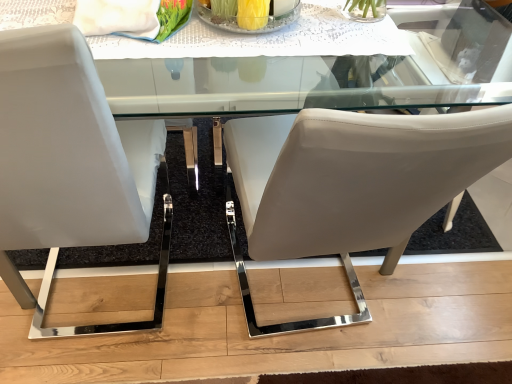
Find the location of a particular element. The image size is (512, 384). clear glass table at upper center is located at coordinates (301, 66).

Describe the element at coordinates (250, 30) in the screenshot. I see `clear glass bowl at center` at that location.

Locate an element on the screen. The image size is (512, 384). white leather chair at left, the first chair when ordered from left to right is located at coordinates (70, 166).

Where is `clear glass table at upper center`? This screenshot has height=384, width=512. clear glass table at upper center is located at coordinates (301, 66).

Does matte white chair at center, positioned as the first chair in right-to-left order, have a smaller size compared to clear glass bowl at center?

No, matte white chair at center, positioned as the first chair in right-to-left order, is not smaller than clear glass bowl at center.

From a real-world perspective, is matte white chair at center, placed as the second chair when sorted from left to right, located higher than clear glass bowl at center?

No, from a real-world perspective, matte white chair at center, placed as the second chair when sorted from left to right, is not on top of clear glass bowl at center.

Based on the photo, from the image's perspective, is matte white chair at center, positioned as the first chair in right-to-left order, over clear glass bowl at center?

Incorrect, from the image's perspective, matte white chair at center, positioned as the first chair in right-to-left order, is lower than clear glass bowl at center.

Which object is positioned more to the right, white leather chair at left, the first chair when ordered from left to right, or clear glass bowl at center?

From the viewer's perspective, clear glass bowl at center appears more on the right side.

Consider the image. From their relative heights in the image, would you say white leather chair at left, the first chair when ordered from left to right, is taller or shorter than clear glass bowl at center?

white leather chair at left, the first chair when ordered from left to right, is taller than clear glass bowl at center.

Is white leather chair at left, the first chair when ordered from left to right, not within clear glass bowl at center?

Yes.

From the image's perspective, is white leather chair at left, the first chair when ordered from left to right, located above clear glass bowl at center?

No, from the image's perspective, white leather chair at left, the first chair when ordered from left to right, is not above clear glass bowl at center.

Could you measure the distance between matte white chair at center, positioned as the first chair in right-to-left order, and clear glass table at upper center?

matte white chair at center, positioned as the first chair in right-to-left order, is 44.74 centimeters from clear glass table at upper center.

Is matte white chair at center, placed as the second chair when sorted from left to right, wider or thinner than clear glass table at upper center?

matte white chair at center, placed as the second chair when sorted from left to right, is wider than clear glass table at upper center.

Is matte white chair at center, placed as the second chair when sorted from left to right, oriented towards clear glass table at upper center?

No, matte white chair at center, placed as the second chair when sorted from left to right, is not facing towards clear glass table at upper center.

Can you tell me how much matte white chair at center, placed as the second chair when sorted from left to right, and clear glass table at upper center differ in facing direction?

The angular difference between matte white chair at center, placed as the second chair when sorted from left to right, and clear glass table at upper center is 178 degrees.

From the image's perspective, which one is positioned lower, clear glass table at upper center or matte white chair at center, placed as the second chair when sorted from left to right?

From the image's view, matte white chair at center, placed as the second chair when sorted from left to right, is below.

Could you tell me if clear glass table at upper center is facing matte white chair at center, positioned as the first chair in right-to-left order?

No.

From a real-world perspective, is clear glass table at upper center physically above matte white chair at center, placed as the second chair when sorted from left to right?

Yes, from a real-world perspective, clear glass table at upper center is on top of matte white chair at center, placed as the second chair when sorted from left to right.

Is clear glass table at upper center positioned behind matte white chair at center, placed as the second chair when sorted from left to right?

Yes, clear glass table at upper center is further from the camera.

Consider the image. Is clear glass table at upper center not close to white leather chair at left, the first chair when ordered from left to right?

That's not correct — clear glass table at upper center is a little close to white leather chair at left, the first chair when ordered from left to right.

Where is `round table positioned vertically above the white leather chair at left, the first chair when ordered from left to right (from a real-world perspective)`? Image resolution: width=512 pixels, height=384 pixels. round table positioned vertically above the white leather chair at left, the first chair when ordered from left to right (from a real-world perspective) is located at coordinates (301, 66).

Would you say clear glass table at upper center contains white leather chair at left, the first chair when ordered from left to right?

No, white leather chair at left, the first chair when ordered from left to right, is not a part of clear glass table at upper center.

Which object is positioned more to the left, clear glass table at upper center or white leather chair at left, the first chair when ordered from left to right?

From the viewer's perspective, white leather chair at left, the first chair when ordered from left to right, appears more on the left side.

Is white leather chair at left, the first chair when ordered from left to right, closer to camera compared to clear glass table at upper center?

Yes.

Is white leather chair at left, the first chair when ordered from left to right, beside clear glass table at upper center?

No, white leather chair at left, the first chair when ordered from left to right, is not beside clear glass table at upper center.

Consider the image. Is white leather chair at left, placed as the 2th chair when sorted from right to left, completely or partially outside of clear glass table at upper center?

Indeed, white leather chair at left, placed as the 2th chair when sorted from right to left, is completely outside clear glass table at upper center.

Considering the sizes of objects white leather chair at left, placed as the 2th chair when sorted from right to left, and clear glass table at upper center in the image provided, who is smaller, white leather chair at left, placed as the 2th chair when sorted from right to left, or clear glass table at upper center?

Smaller between the two is clear glass table at upper center.

Which is less distant, [242,33] or [7,160]?

Point [242,33] is positioned farther from the camera compared to point [7,160].

Where is `glass plate above the white leather chair at left, the first chair when ordered from left to right (from the image's perspective)`? glass plate above the white leather chair at left, the first chair when ordered from left to right (from the image's perspective) is located at coordinates (250, 30).

Would you say clear glass bowl at center is outside white leather chair at left, the first chair when ordered from left to right?

Yes.

Which of these two, clear glass bowl at center or white leather chair at left, the first chair when ordered from left to right, stands taller?

With more height is white leather chair at left, the first chair when ordered from left to right.

Find the location of a particular element. glass plate above the matte white chair at center, placed as the second chair when sorted from left to right (from the image's perspective) is located at coordinates (250, 30).

Identify the location of the 1st chair located beneath the clear glass bowl at center (from a real-world perspective). Image resolution: width=512 pixels, height=384 pixels. (70, 166).

Based on their spatial positions, is clear glass table at upper center or white leather chair at left, placed as the 2th chair when sorted from right to left, closer to matte white chair at center, placed as the second chair when sorted from left to right?

The object closer to matte white chair at center, placed as the second chair when sorted from left to right, is white leather chair at left, placed as the 2th chair when sorted from right to left.

Estimate the real-world distances between objects in this image. Which object is further from white leather chair at left, the first chair when ordered from left to right, clear glass table at upper center or clear glass bowl at center?

The object further to white leather chair at left, the first chair when ordered from left to right, is clear glass table at upper center.

Looking at the image, which one is located closer to matte white chair at center, positioned as the first chair in right-to-left order, clear glass table at upper center or clear glass bowl at center?

clear glass table at upper center is positioned closer to the anchor matte white chair at center, positioned as the first chair in right-to-left order.

When comparing their distances from white leather chair at left, the first chair when ordered from left to right, does matte white chair at center, positioned as the first chair in right-to-left order, or clear glass bowl at center seem further?

clear glass bowl at center is positioned further to the anchor white leather chair at left, the first chair when ordered from left to right.

Consider the image. Based on their spatial positions, is white leather chair at left, placed as the 2th chair when sorted from right to left, or matte white chair at center, positioned as the first chair in right-to-left order, closer to clear glass table at upper center?

The object closer to clear glass table at upper center is matte white chair at center, positioned as the first chair in right-to-left order.

Looking at the image, which one is located further to clear glass bowl at center, matte white chair at center, placed as the second chair when sorted from left to right, or clear glass table at upper center?

Based on the image, clear glass table at upper center appears to be further to clear glass bowl at center.

Looking at the image, which one is located closer to white leather chair at left, placed as the 2th chair when sorted from right to left, clear glass bowl at center or matte white chair at center, placed as the second chair when sorted from left to right?

Result: matte white chair at center, placed as the second chair when sorted from left to right.

When comparing their distances from clear glass table at upper center, does clear glass bowl at center or matte white chair at center, positioned as the first chair in right-to-left order, seem further?

Among the two, clear glass bowl at center is located further to clear glass table at upper center.

Image resolution: width=512 pixels, height=384 pixels. I want to click on glass plate between white leather chair at left, placed as the 2th chair when sorted from right to left, and matte white chair at center, positioned as the first chair in right-to-left order, in the horizontal direction, so click(250, 30).

Where is `round table located between matte white chair at center, positioned as the first chair in right-to-left order, and clear glass bowl at center in the depth direction`? This screenshot has width=512, height=384. round table located between matte white chair at center, positioned as the first chair in right-to-left order, and clear glass bowl at center in the depth direction is located at coordinates (301, 66).

Find the location of a particular element. round table situated between white leather chair at left, placed as the 2th chair when sorted from right to left, and matte white chair at center, positioned as the first chair in right-to-left order, from left to right is located at coordinates (301, 66).

This screenshot has height=384, width=512. I want to click on round table between white leather chair at left, placed as the 2th chair when sorted from right to left, and clear glass bowl at center, in the horizontal direction, so click(x=301, y=66).